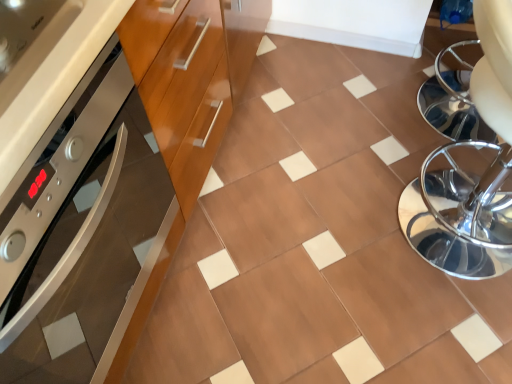
Question: Can you confirm if brown glossy tile at center is thinner than polished chrome swivel chair at right?

Choices:
 (A) yes
 (B) no

Answer: (B)

Question: Can you confirm if brown glossy tile at center is shorter than polished chrome swivel chair at right?

Choices:
 (A) no
 (B) yes

Answer: (B)

Question: Is brown glossy tile at center taller than polished chrome swivel chair at right?

Choices:
 (A) no
 (B) yes

Answer: (A)

Question: Is brown glossy tile at center not within polished chrome swivel chair at right?

Choices:
 (A) yes
 (B) no

Answer: (A)

Question: Does brown glossy tile at center come in front of polished chrome swivel chair at right?

Choices:
 (A) yes
 (B) no

Answer: (B)

Question: Considering their positions, is wooden cabinet at left located in front of or behind brown glossy tile at center?

Choices:
 (A) front
 (B) behind

Answer: (A)

Question: Is point (192, 185) positioned closer to the camera than point (243, 225)?

Choices:
 (A) farther
 (B) closer

Answer: (B)

Question: In terms of height, does wooden cabinet at left look taller or shorter compared to brown glossy tile at center?

Choices:
 (A) tall
 (B) short

Answer: (A)

Question: From a real-world perspective, relative to brown glossy tile at center, is wooden cabinet at left vertically above or below?

Choices:
 (A) below
 (B) above

Answer: (B)

Question: Is point (148, 326) positioned closer to the camera than point (489, 57)?

Choices:
 (A) closer
 (B) farther

Answer: (B)

Question: From a real-world perspective, is brown glossy tile at center physically located above or below polished chrome swivel chair at right?

Choices:
 (A) above
 (B) below

Answer: (B)

Question: From the image's perspective, is brown glossy tile at center located above or below polished chrome swivel chair at right?

Choices:
 (A) below
 (B) above

Answer: (B)

Question: Considering the relative positions of brown glossy tile at center and polished chrome swivel chair at right in the image provided, is brown glossy tile at center to the left or to the right of polished chrome swivel chair at right?

Choices:
 (A) left
 (B) right

Answer: (A)

Question: Relative to wooden cabinet at left, is polished chrome swivel chair at right in front or behind?

Choices:
 (A) front
 (B) behind

Answer: (B)

Question: Considering the positions of point (493, 208) and point (82, 77), is point (493, 208) closer or farther from the camera than point (82, 77)?

Choices:
 (A) closer
 (B) farther

Answer: (B)